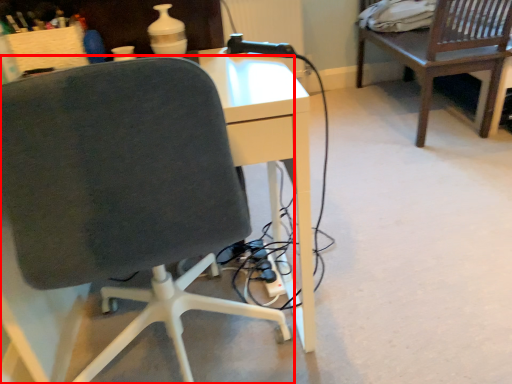
Question: From the image's perspective, what is the correct spatial relationship of chair (annotated by the red box) in relation to table?

Choices:
 (A) above
 (B) below

Answer: (B)